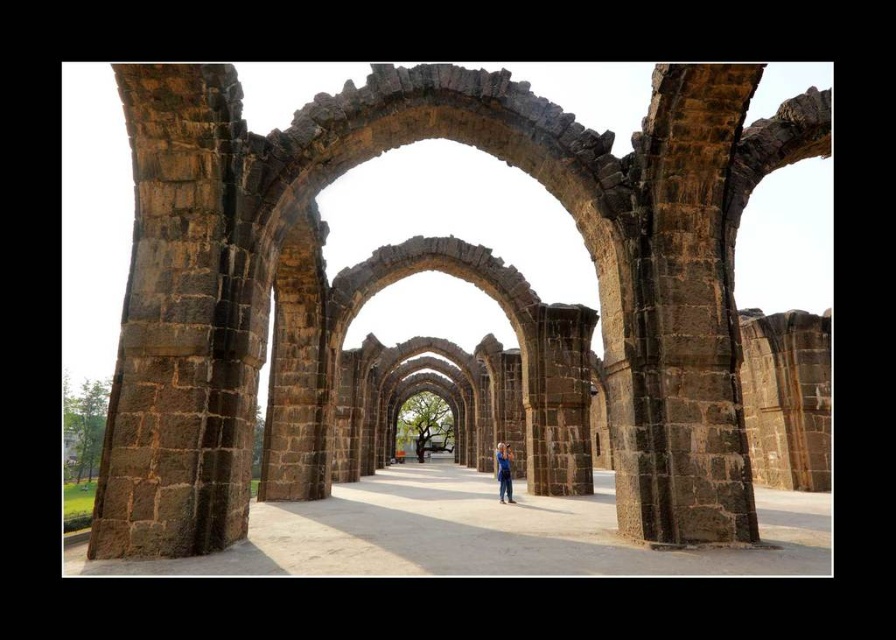
You are standing in front of the ancient stone arches and notice two points marked in the scene. The first point is at coordinates point [517,522] and the second is at point [507,486]. Which of these two points is nearer to your current position?

Point [517,522] is closer to the camera than point [507,486], so the first point is nearer to your current position.